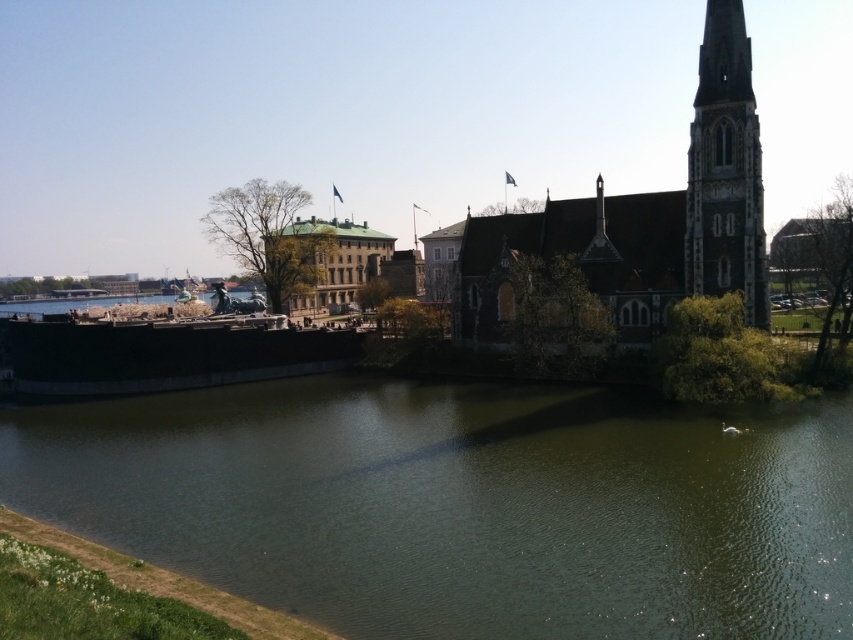
Question: Is greenish water at center to the right of dark gray stone tower at upper right from the viewer's perspective?

Choices:
 (A) no
 (B) yes

Answer: (A)

Question: Can you confirm if greenish water at center is positioned below dark gray stone tower at upper right?

Choices:
 (A) yes
 (B) no

Answer: (A)

Question: Which object appears farthest from the camera in this image?

Choices:
 (A) dark gray stone tower at upper right
 (B) greenish water at center
 (C) stone gothic church at right

Answer: (C)

Question: Estimate the real-world distances between objects in this image. Which object is closer to the rustic wooden barge at lower left?

Choices:
 (A) green shingled roof building at center
 (B) greenish water at center
 (C) dark gray stone tower at upper right
 (D) stone gothic church at right

Answer: (B)

Question: Which of the following is the closest to the observer?

Choices:
 (A) rustic wooden barge at lower left
 (B) greenish water at center

Answer: (B)

Question: Is greenish water at center positioned at the back of rustic wooden barge at lower left?

Choices:
 (A) yes
 (B) no

Answer: (B)